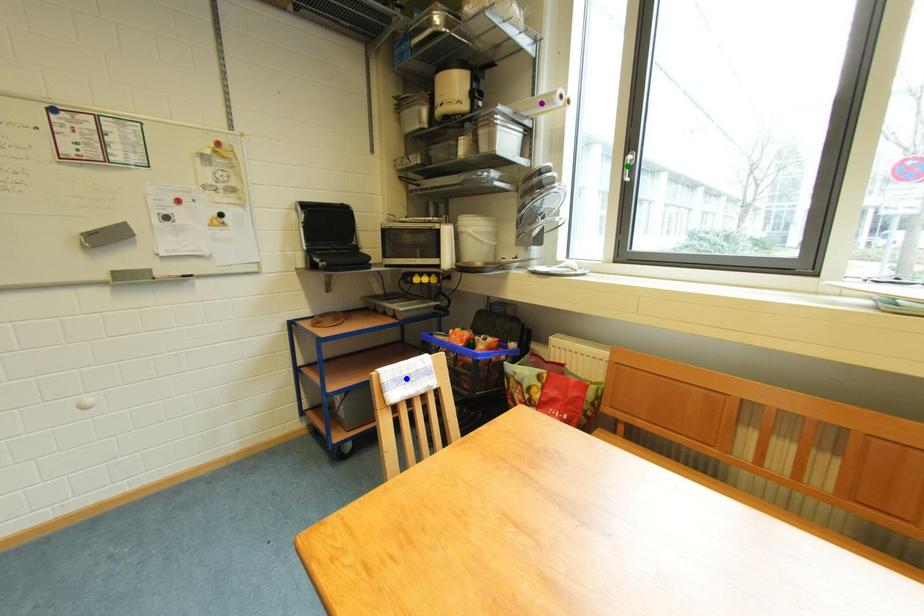
Order these from farthest to nearest:
green point, purple point, blue point

1. green point
2. purple point
3. blue point